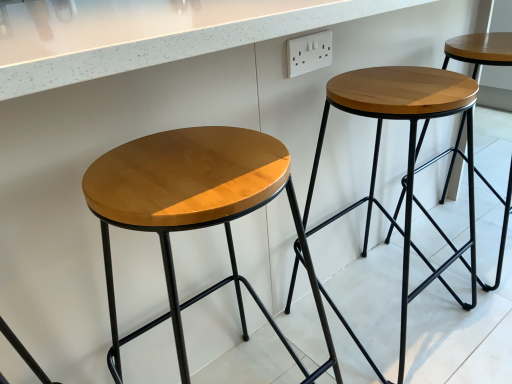
Locate an element on the screen. This screenshot has width=512, height=384. vacant point above matte wood stool at center, which is the second stool in right-to-left order (from a real-world perspective) is located at coordinates (188, 166).